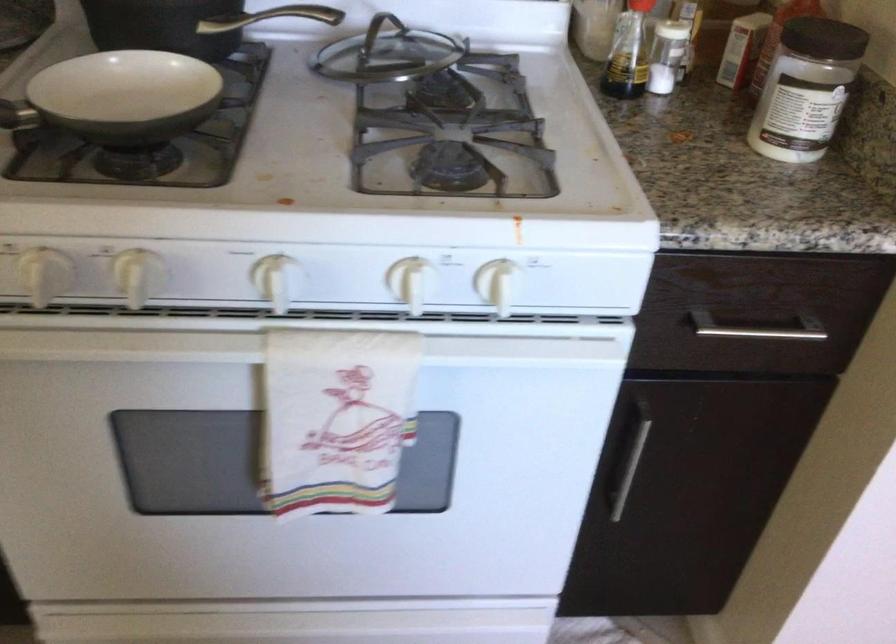
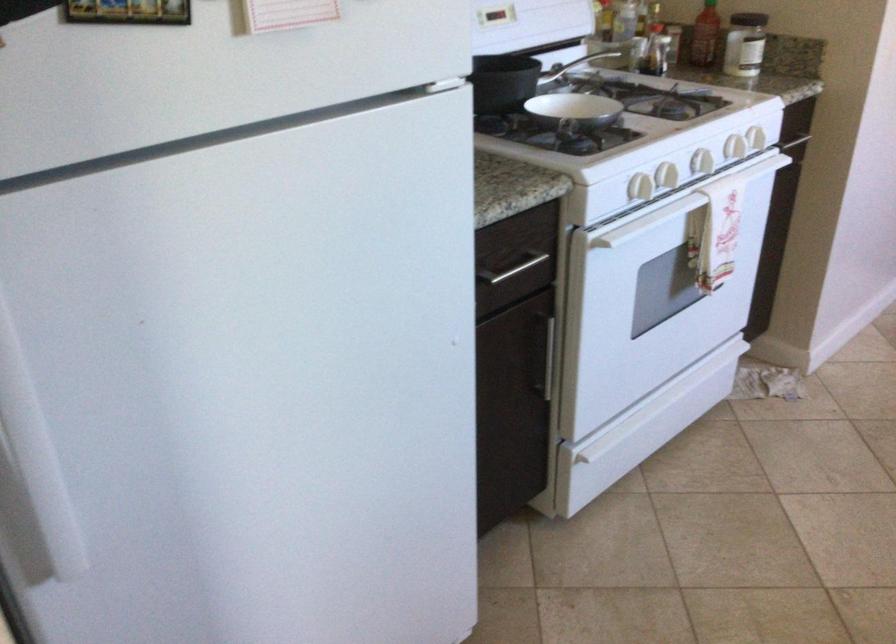
Find the pixel in the second image that matches point (85, 401) in the first image.

(679, 205)